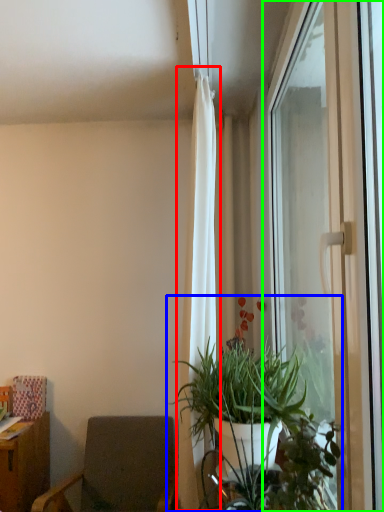
Question: Which object is positioned farthest from curtain (highlighted by a red box)? Select from houseplant (highlighted by a blue box) and window (highlighted by a green box).

Choices:
 (A) houseplant
 (B) window

Answer: (B)